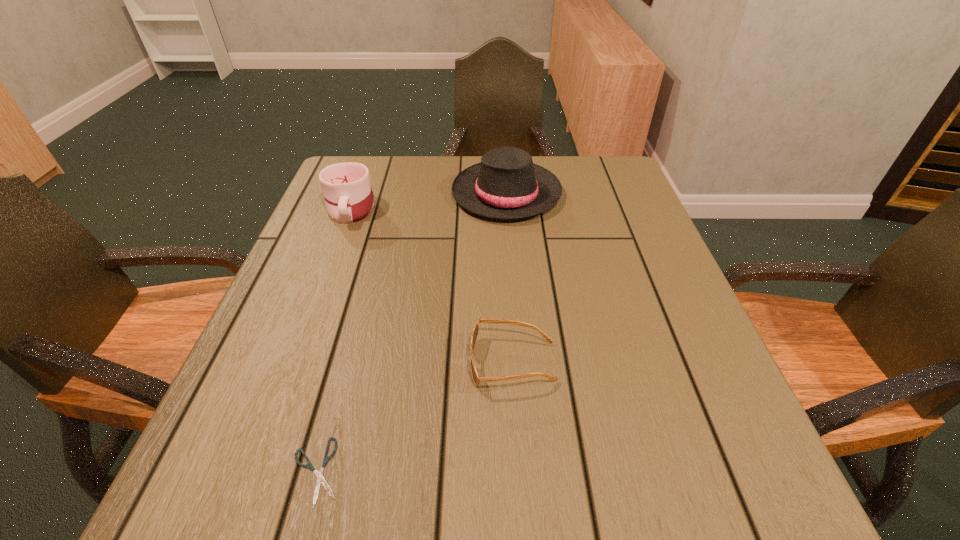
This screenshot has width=960, height=540. I want to click on vacant region at the near edge of the desktop, so click(453, 517).

What are the coordinates of `free region at the left edge` in the screenshot? It's located at (293, 426).

Image resolution: width=960 pixels, height=540 pixels. In order to click on vacant space at the right edge in this screenshot , I will do `click(591, 210)`.

In the image, there is a desktop. Find the location of `vacant space at the far left corner`. vacant space at the far left corner is located at coordinates (368, 167).

Where is `free region at the far right corner`? This screenshot has width=960, height=540. free region at the far right corner is located at coordinates (586, 179).

In order to click on unoccupied area between the dress hat and the sunglasses in this screenshot , I will do `click(510, 278)`.

Where is `empty space that is in between the second nearest object and the nearest object`? This screenshot has height=540, width=960. empty space that is in between the second nearest object and the nearest object is located at coordinates (415, 417).

This screenshot has height=540, width=960. In order to click on vacant region between the dress hat and the mug in this screenshot , I will do `click(428, 201)`.

Locate an element on the screen. This screenshot has height=540, width=960. free space between the mug and the nearest object is located at coordinates (333, 340).

You are a GUI agent. You are given a task and a screenshot of the screen. Output one action in this format:
    pyautogui.click(x=<x>, y=<y>)
    Task: Click on the vacant region between the shortest object and the second shortest object
    Image resolution: width=960 pixels, height=540 pixels.
    Given the screenshot: What is the action you would take?
    pyautogui.click(x=415, y=417)